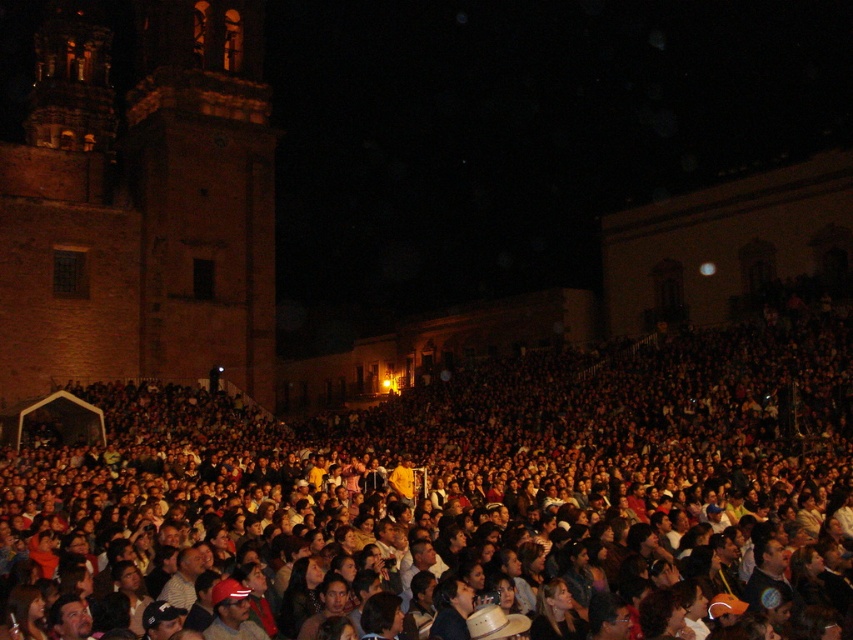
Can you confirm if dark brown hair at center is positioned to the left of brick church at left?

No, dark brown hair at center is not to the left of brick church at left.

Does point (524, 394) come in front of point (248, 252)?

Yes.

Image resolution: width=853 pixels, height=640 pixels. Describe the element at coordinates (474, 452) in the screenshot. I see `dark brown hair at center` at that location.

Find the location of `dark brown hair at center`. dark brown hair at center is located at coordinates (474, 452).